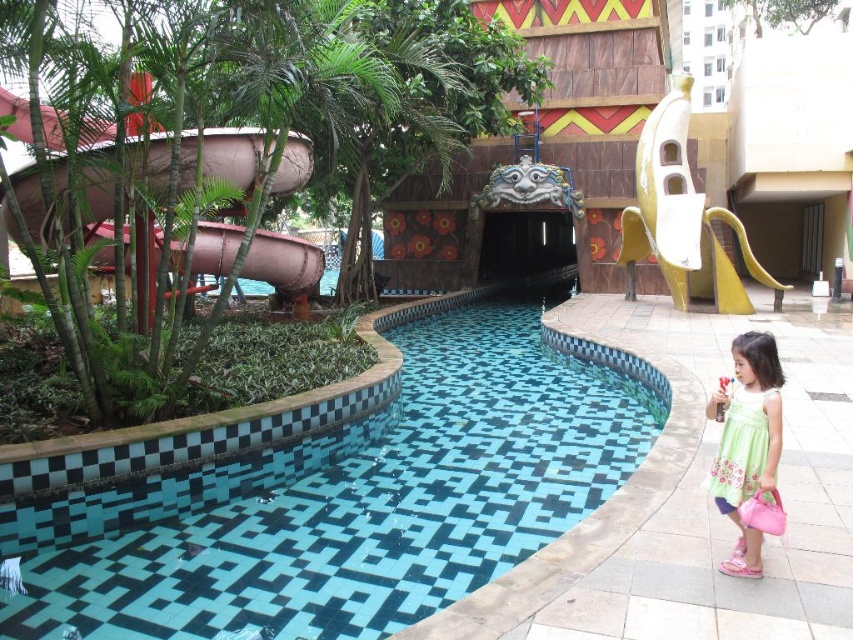
Which is below, blue mosaic tiles at center or green floral dress at lower right?

green floral dress at lower right is lower down.

Is blue mosaic tiles at center taller than green floral dress at lower right?

Indeed, blue mosaic tiles at center has a greater height compared to green floral dress at lower right.

What do you see at coordinates (355, 449) in the screenshot? Image resolution: width=853 pixels, height=640 pixels. I see `blue mosaic tiles at center` at bounding box center [355, 449].

The width and height of the screenshot is (853, 640). In order to click on blue mosaic tiles at center in this screenshot , I will do `click(355, 449)`.